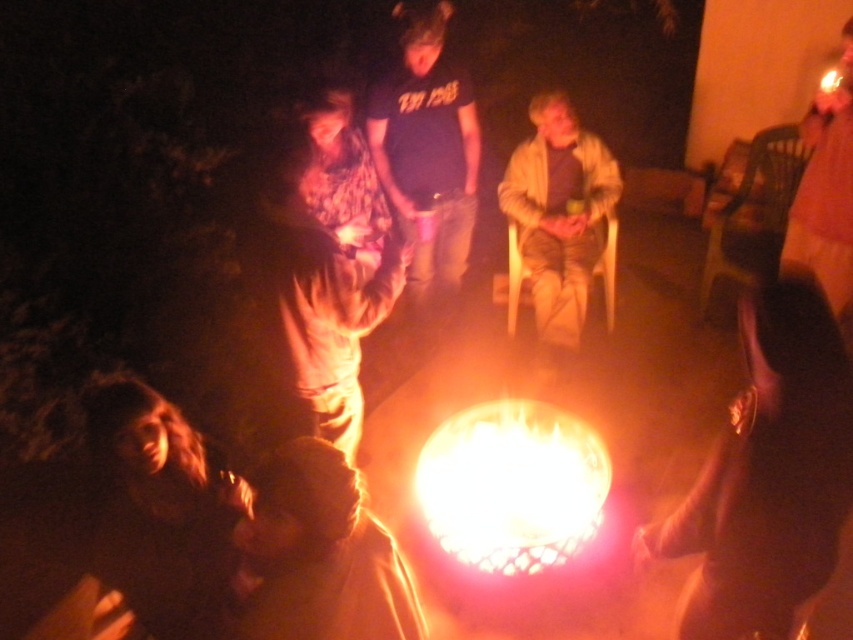
Question: Is flamematerial/texture at center in front of dark blue t-shirt at center?

Choices:
 (A) no
 (B) yes

Answer: (B)

Question: Which object appears closest to the camera in this image?

Choices:
 (A) flamematerial/texture at center
 (B) pink fabric at right

Answer: (A)

Question: Which object is closer to the camera taking this photo?

Choices:
 (A) flamematerial/texture at center
 (B) light brown fabric jacket at center

Answer: (A)

Question: Is fluffy beige pants at center thinner than flamematerial/texture at center?

Choices:
 (A) yes
 (B) no

Answer: (B)

Question: Is dark blue t-shirt at center in front of pink fabric at right?

Choices:
 (A) yes
 (B) no

Answer: (B)

Question: Which point appears closest to the camera in this image?

Choices:
 (A) (424, 13)
 (B) (440, 524)
 (C) (791, 262)
 (D) (556, 122)

Answer: (B)